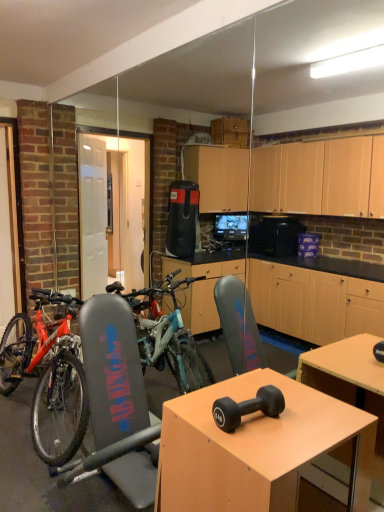
The height and width of the screenshot is (512, 384). Identify the location of blank space situated above matte wood desk at center (from a real-world perspective). (261, 415).